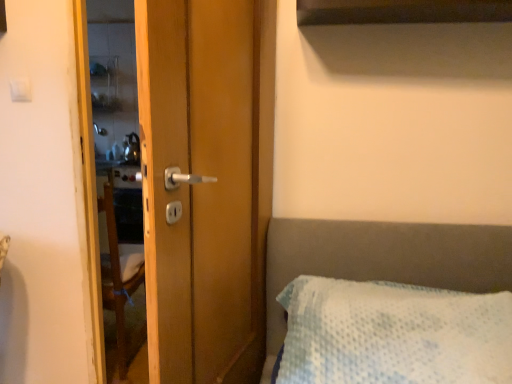
Describe the element at coordinates (20, 89) in the screenshot. I see `white plastic light switch at upper left` at that location.

Image resolution: width=512 pixels, height=384 pixels. In order to click on white plastic light switch at upper left in this screenshot , I will do `click(20, 89)`.

What do you see at coordinates (197, 186) in the screenshot?
I see `wooden door handle at center` at bounding box center [197, 186].

This screenshot has height=384, width=512. Find the location of `wooden door handle at center`. wooden door handle at center is located at coordinates (197, 186).

What is the approximate height of wooden door handle at center?

1.50 meters.

Where is `white plastic light switch at upper left`? The image size is (512, 384). white plastic light switch at upper left is located at coordinates (20, 89).

Considering the relative positions of wooden door handle at center and white plastic light switch at upper left in the image provided, is wooden door handle at center to the left of white plastic light switch at upper left from the viewer's perspective?

No, wooden door handle at center is not to the left of white plastic light switch at upper left.

Is wooden door handle at center further to the viewer compared to white plastic light switch at upper left?

No.

Considering the positions of points (251, 184) and (24, 87), is point (251, 184) farther from camera compared to point (24, 87)?

No, (251, 184) is in front of (24, 87).

From the image's perspective, which object appears higher, wooden door handle at center or white plastic light switch at upper left?

white plastic light switch at upper left, from the image's perspective.

From a real-world perspective, is wooden door handle at center beneath white plastic light switch at upper left?

Yes, from a real-world perspective, wooden door handle at center is below white plastic light switch at upper left.

Between wooden door handle at center and white plastic light switch at upper left, which one has smaller width?

With smaller width is white plastic light switch at upper left.

Who is shorter, wooden door handle at center or white plastic light switch at upper left?

white plastic light switch at upper left is shorter.

Is wooden door handle at center smaller than white plastic light switch at upper left?

Incorrect, wooden door handle at center is not smaller in size than white plastic light switch at upper left.

Is white plastic light switch at upper left completely or partially inside wooden door handle at center?

Actually, white plastic light switch at upper left is outside wooden door handle at center.

Is wooden door handle at center not near white plastic light switch at upper left?

That's right, there is a large distance between wooden door handle at center and white plastic light switch at upper left.

Is white plastic light switch at upper left at the back of wooden door handle at center?

No, white plastic light switch at upper left is not at the back of wooden door handle at center.

How different are the orientations of wooden door handle at center and white plastic light switch at upper left in degrees?

110 degrees.

This screenshot has height=384, width=512. What are the coordinates of `light switch on the left side of wooden door handle at center` in the screenshot? It's located at (20, 89).

Is white plastic light switch at upper left at the right side of wooden door handle at center?

Incorrect, white plastic light switch at upper left is not on the right side of wooden door handle at center.

Who is more distant, white plastic light switch at upper left or wooden door handle at center?

white plastic light switch at upper left is more distant.

Between point (27, 89) and point (216, 225), which one is positioned behind?

Positioned behind is point (27, 89).

From the image's perspective, which is below, white plastic light switch at upper left or wooden door handle at center?

wooden door handle at center is shown below in the image.

From a real-world perspective, is white plastic light switch at upper left beneath wooden door handle at center?

No, from a real-world perspective, white plastic light switch at upper left is not under wooden door handle at center.

Which of these two, white plastic light switch at upper left or wooden door handle at center, is wider?

wooden door handle at center is wider.

Is white plastic light switch at upper left shorter than wooden door handle at center?

Correct, white plastic light switch at upper left is not as tall as wooden door handle at center.

Who is smaller, white plastic light switch at upper left or wooden door handle at center?

With smaller size is white plastic light switch at upper left.

Is white plastic light switch at upper left spatially inside wooden door handle at center, or outside of it?

white plastic light switch at upper left is outside wooden door handle at center.

Is white plastic light switch at upper left beside wooden door handle at center?

No, white plastic light switch at upper left is not making contact with wooden door handle at center.

Is white plastic light switch at upper left aimed at wooden door handle at center?

No.

Measure the distance from white plastic light switch at upper left to wooden door handle at center.

white plastic light switch at upper left and wooden door handle at center are 1.03 meters apart from each other.

Locate an element on the screen. screen door on the right side of white plastic light switch at upper left is located at coordinates (197, 186).

The width and height of the screenshot is (512, 384). What are the coordinates of `screen door that appears below the white plastic light switch at upper left (from the image's perspective)` in the screenshot? It's located at (197, 186).

The height and width of the screenshot is (384, 512). Identify the location of light switch on the left of wooden door handle at center. (20, 89).